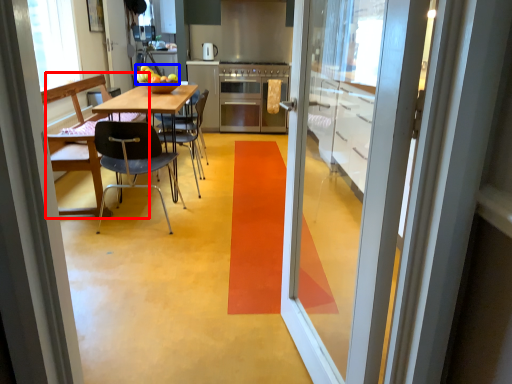
Question: Among these objects, which one is nearest to the camera, chair (highlighted by a red box) or fruit (highlighted by a blue box)?

Choices:
 (A) chair
 (B) fruit

Answer: (A)